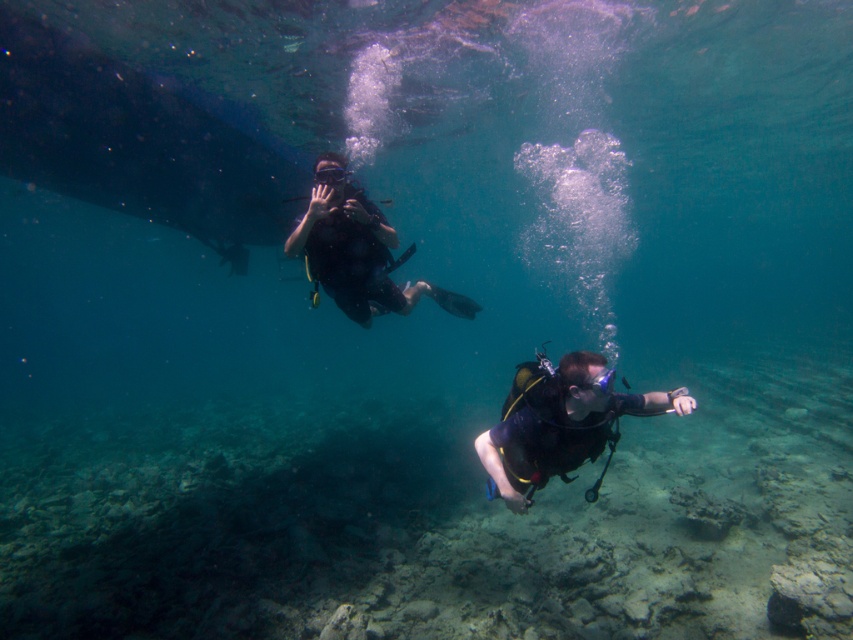
You are a marine biologist planning to place a 3.5 meter long research rope between the matte black scuba diver at center and the transparent rubber goggles at upper center. Can you fit the entire rope between them without bending it?

The distance between the matte black scuba diver at center and the transparent rubber goggles at upper center is 3.35 meters. Since the rope is 3.5 meters long, it is slightly longer than the available space. Therefore, the entire rope cannot be placed between them without bending it.

You are a scuba diver trying to determine your position relative to two points underwater. You see point A at coordinates point (492, 497) and point B at coordinates point (341, 291). Which point is closer to you?

Point A at coordinates point (492, 497) is closer to you than point B at coordinates point (341, 291).

You are a marine biologist observing the underwater scene. You notice the matte black scuba diver at center and the transparent rubber goggles at upper center. Which object appears taller in the image?

The matte black scuba diver at center appears taller than the transparent rubber goggles at upper center.